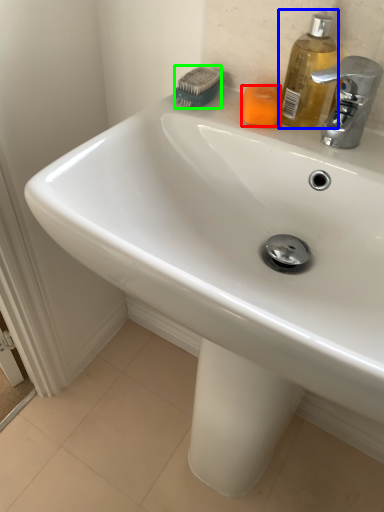
Question: Estimate the real-world distances between objects in this image. Which object is closer to soap (highlighted by a red box), soap dispenser (highlighted by a blue box) or brush (highlighted by a green box)?

Choices:
 (A) soap dispenser
 (B) brush

Answer: (A)